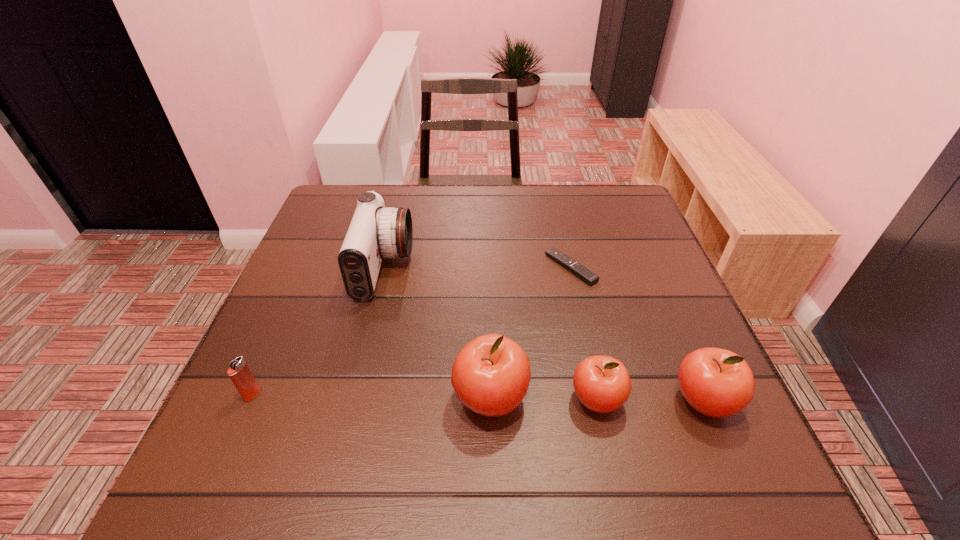
Locate an element on the screen. The height and width of the screenshot is (540, 960). free spot that satisfies the following two spatial constraints: 1. on the back side of the shortest object; 2. on the left side of the leftmost object is located at coordinates (308, 267).

Locate an element on the screen. The height and width of the screenshot is (540, 960). free space that satisfies the following two spatial constraints: 1. on the surface of the fourth object from right to left; 2. on the left side of the fifth object from right to left is located at coordinates (352, 398).

You are a GUI agent. You are given a task and a screenshot of the screen. Output one action in this format:
    pyautogui.click(x=<x>, y=<y>)
    Task: Click on the vacant space that satisfies the following two spatial constraints: 1. on the front side of the shortest object; 2. on the surface of the second object from left to right
    The height and width of the screenshot is (540, 960).
    Given the screenshot: What is the action you would take?
    pyautogui.click(x=571, y=268)

I want to click on vacant space that satisfies the following two spatial constraints: 1. on the front side of the shortest object; 2. on the surface of the fifth object from right to left, so pyautogui.click(x=571, y=268).

The image size is (960, 540). I want to click on free space that satisfies the following two spatial constraints: 1. on the surface of the fifth object from right to left; 2. on the right side of the fourth tallest object, so click(352, 399).